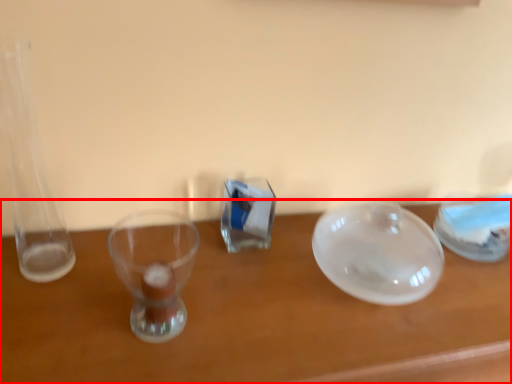
Question: From the image's perspective, considering the relative positions of table (annotated by the red box) and tableware in the image provided, where is table (annotated by the red box) located with respect to the staircase?

Choices:
 (A) below
 (B) above

Answer: (A)